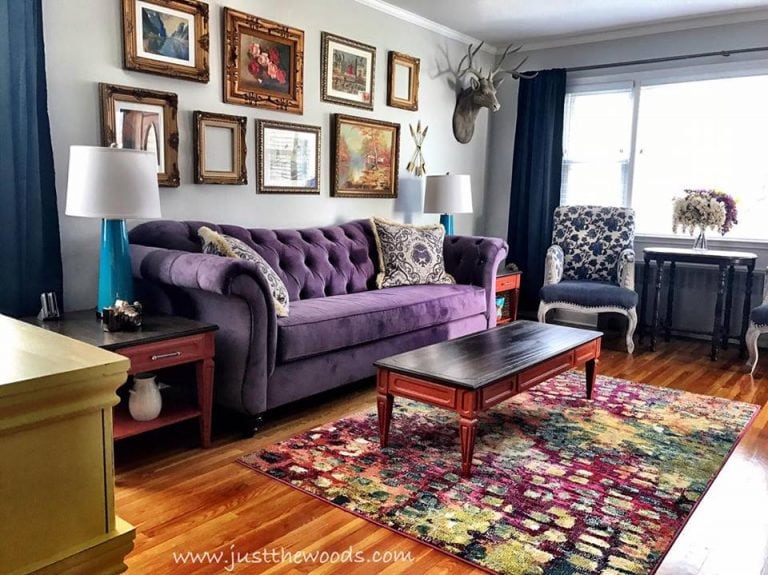
Locate an element on the screen. This screenshot has width=768, height=575. faux taxidermy is located at coordinates (482, 97).